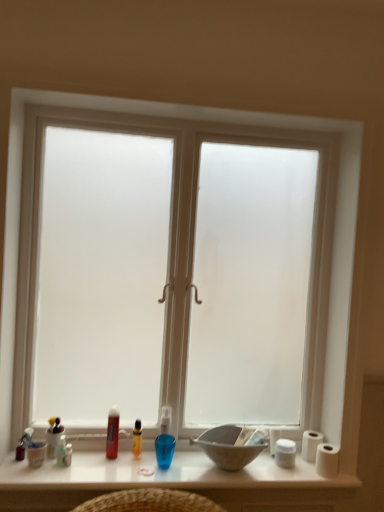
Locate an element on the screen. free space on the front side of white matte toilet paper at right, which is the 1th toilet paper from back to front is located at coordinates (307, 474).